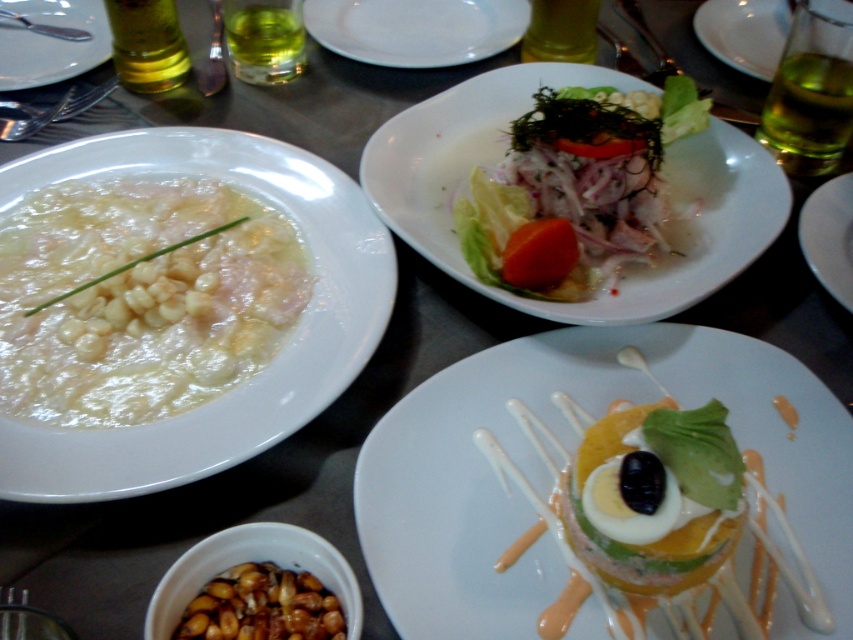
Who is more distant from viewer, (350,204) or (746,10)?

Positioned behind is point (746,10).

Who is more forward, (x=248, y=134) or (x=782, y=29)?

Point (x=248, y=134) is more forward.

The width and height of the screenshot is (853, 640). Identify the location of white creamy soup at left. (254, 372).

Can you confirm if brown glossy nuts at lower left is smaller than white creamy soup at upper center?

Indeed, brown glossy nuts at lower left has a smaller size compared to white creamy soup at upper center.

Consider the image. Is brown glossy nuts at lower left taller than white creamy soup at upper center?

Incorrect, brown glossy nuts at lower left's height is not larger of white creamy soup at upper center's.

Between point (189, 627) and point (821, 65), which one is positioned in front?

Positioned in front is point (189, 627).

Locate an element on the screen. This screenshot has width=853, height=640. brown glossy nuts at lower left is located at coordinates (257, 588).

Can you confirm if white glossy plate at upper left is positioned to the left of white glossy plate at center?

Indeed, white glossy plate at upper left is positioned on the left side of white glossy plate at center.

Does point (51, 8) come closer to viewer compared to point (824, 230)?

No, it is not.

Is point (79, 72) closer to viewer compared to point (831, 209)?

That is False.

At what (x,y) coordinates should I click in order to perform the action: click on white glossy plate at upper left. Please return your answer as a coordinate pair (x, y). This screenshot has width=853, height=640. Looking at the image, I should click on (50, 42).